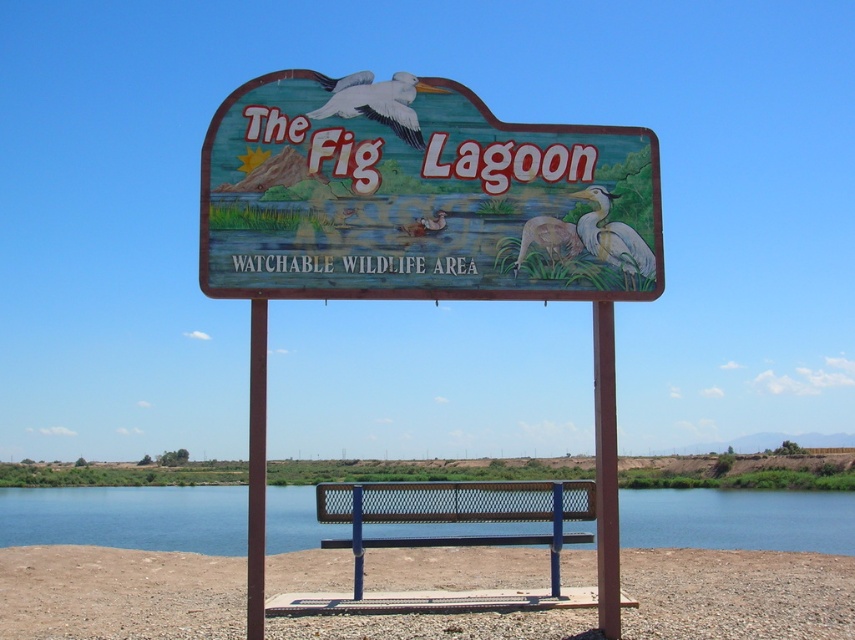
Question: Is wooden sign at center further to camera compared to metal mesh bench at center?

Choices:
 (A) no
 (B) yes

Answer: (A)

Question: Which of the following is the closest to the observer?

Choices:
 (A) (665, 522)
 (B) (488, 211)
 (C) (540, 483)

Answer: (B)

Question: Does wooden sign at center appear on the left side of metal mesh bench at center?

Choices:
 (A) yes
 (B) no

Answer: (A)

Question: Which point is farther from the camera taking this photo?

Choices:
 (A) (528, 228)
 (B) (486, 484)

Answer: (B)

Question: Does wooden sign at center have a greater width compared to blue water at bench center?

Choices:
 (A) yes
 (B) no

Answer: (B)

Question: Which object is the farthest from the wooden sign at center?

Choices:
 (A) metal mesh bench at center
 (B) blue water at bench center

Answer: (B)